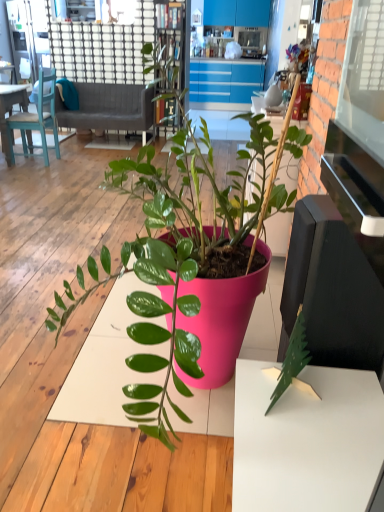
Question: From the image's perspective, is wooden bookshelf at upper center positioned above or below matte pink pot at center?

Choices:
 (A) below
 (B) above

Answer: (B)

Question: In terms of width, does wooden bookshelf at upper center look wider or thinner when compared to matte pink pot at center?

Choices:
 (A) wide
 (B) thin

Answer: (B)

Question: Based on their relative distances, which object is farther from the matte pink pot at center?

Choices:
 (A) matte plastic figurine at upper center
 (B) wooden bookshelf at upper center
 (C) matte blue desk at left
 (D) teal wooden chair at upper left
 (E) gray fabric couch at upper left

Answer: (E)

Question: Estimate the real-world distances between objects in this image. Which object is farther from the gray fabric couch at upper left?

Choices:
 (A) teal wooden chair at upper left
 (B) matte plastic figurine at upper center
 (C) matte pink pot at center
 (D) wooden bookshelf at upper center
 (E) matte blue desk at left

Answer: (C)